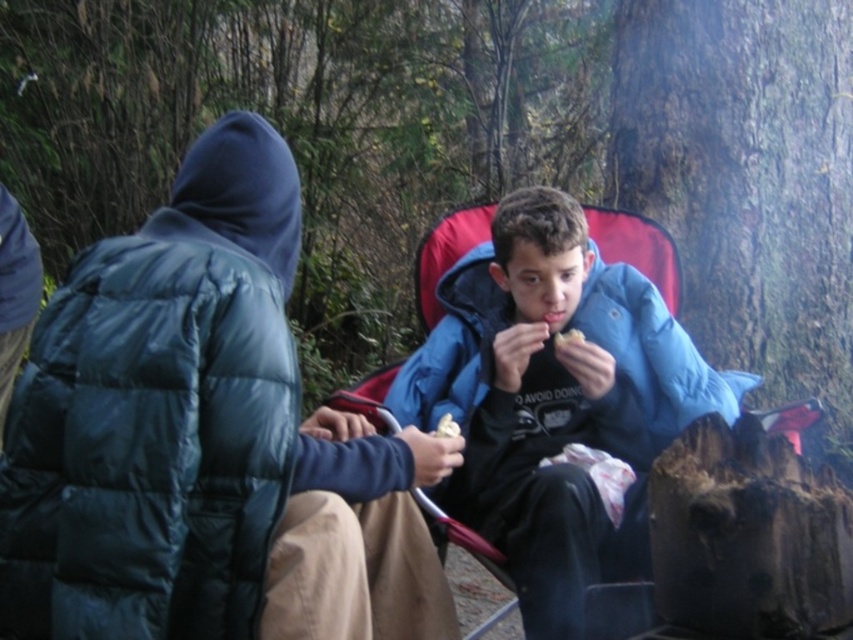
You are a photographer trying to capture a closeup of the blue puffy jacket at center. According to the coordinates provided, where should you aim your camera?

The blue puffy jacket at center is located at point 0.625 on the x axis and 0.652 on the y axis, so aim your camera at those coordinates.

You are standing at the origin point of the coordinate system. You see two points in the image, point (444, 433) and point (572, 337). Which point is closer to you?

Point (444, 433) is in front of point (572, 337), so it is closer to you.

You are a photographer trying to capture both the white crumbly bread at center and the white crumbly snack at center in a single shot. Which one should you focus on first to ensure both are in frame?

The white crumbly bread at center is below the white crumbly snack at center, so focus on the snack first to ensure both are in frame.